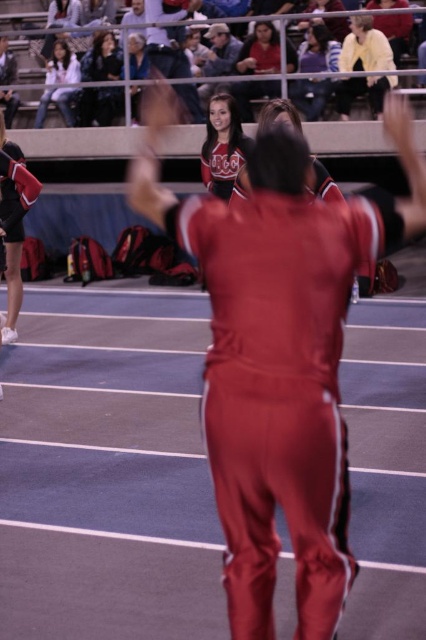
Question: Is matte black jacket at upper left smaller than matte white jacket at upper left?

Choices:
 (A) no
 (B) yes

Answer: (A)

Question: Among these objects, which one is farthest from the camera?

Choices:
 (A) matte white jacket at upper left
 (B) matte black jacket at upper center
 (C) matte black jacket at upper left

Answer: (A)

Question: Does matte black shorts at left have a lesser width compared to matte black jacket at upper left?

Choices:
 (A) yes
 (B) no

Answer: (A)

Question: Where is matte red cheerleading outfit at upper center located in relation to matte black jacket at upper left in the image?

Choices:
 (A) left
 (B) right

Answer: (B)

Question: Which point appears farthest from the camera in this image?

Choices:
 (A) (244, 145)
 (B) (25, 92)

Answer: (B)

Question: Estimate the real-world distances between objects in this image. Which object is closer to the light yellow jacket at upper right?

Choices:
 (A) matte red cheerleading outfit at upper center
 (B) matte black shorts at left

Answer: (A)